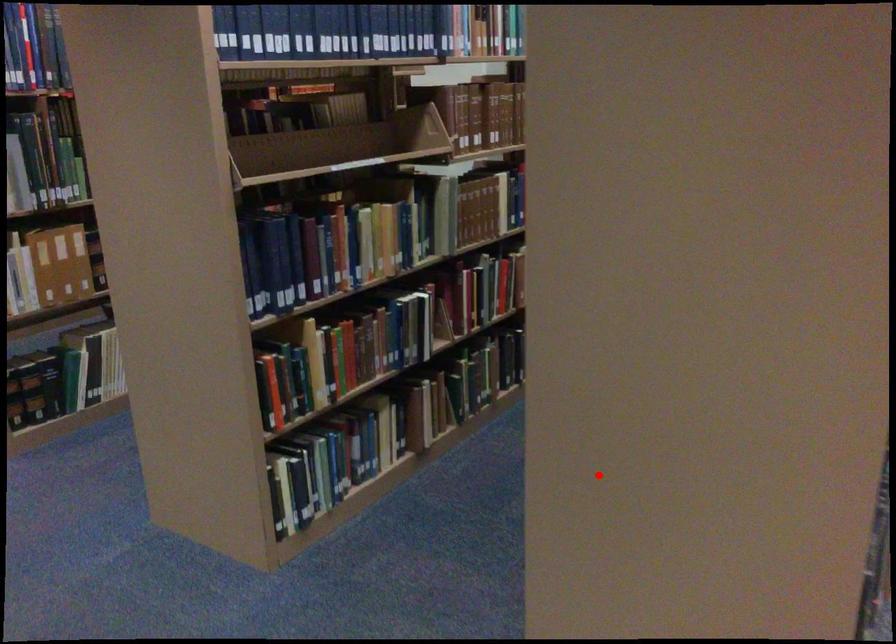
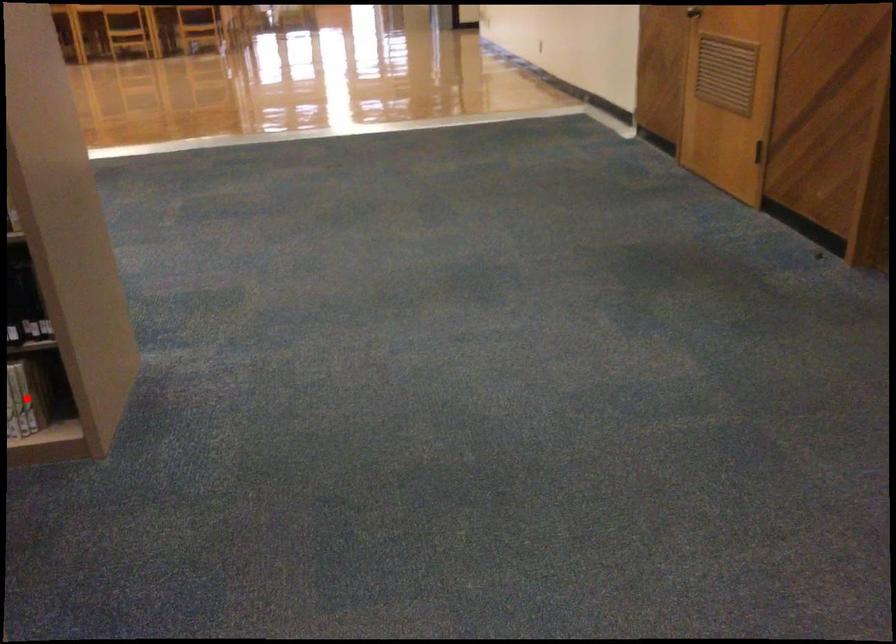
I am providing you with two images of the same scene from different viewpoints. A red point is marked on the first image and another point is marked on the second image. Is the marked point in image1 the same physical position as the marked point in image2?

No